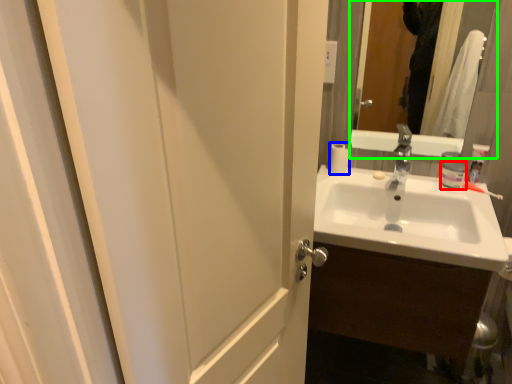
Question: Considering the real-world distances, which object is closest to toiletry (highlighted by a red box)? toilet paper (highlighted by a blue box) or mirror (highlighted by a green box).

Choices:
 (A) toilet paper
 (B) mirror

Answer: (A)